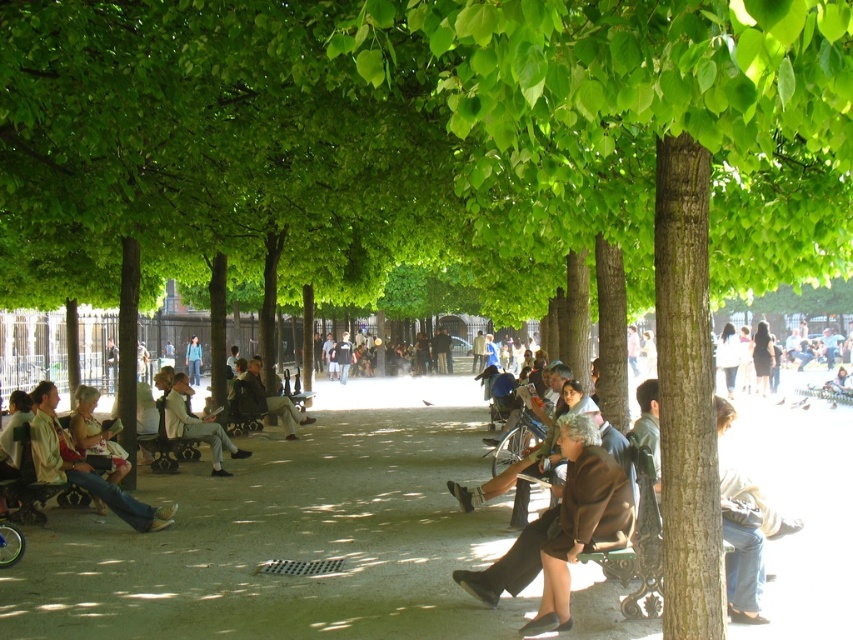
Question: Observing the image, what is the correct spatial positioning of brown fabric coat at center in reference to light brown leather jacket at center?

Choices:
 (A) below
 (B) above

Answer: (A)

Question: Does light gray fabric pants at center appear under blue jeans at center?

Choices:
 (A) no
 (B) yes

Answer: (B)

Question: Which object is positioned farthest from the light brown leather jacket at center?

Choices:
 (A) denim jeans at left
 (B) brown fabric coat at center

Answer: (B)

Question: Which of the following is the closest to the observer?

Choices:
 (A) denim jeans at left
 (B) light brown leather jacket at center
 (C) blue jeans at center

Answer: (A)

Question: Considering the relative positions of denim jeans at left and light gray fabric pants at center in the image provided, where is denim jeans at left located with respect to light gray fabric pants at center?

Choices:
 (A) below
 (B) above

Answer: (B)

Question: Which of the following is the closest to the observer?

Choices:
 (A) (194, 372)
 (B) (281, 417)

Answer: (B)